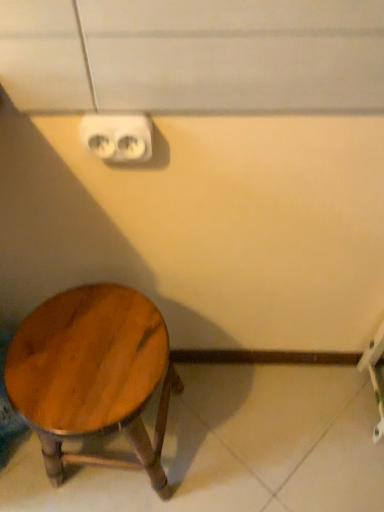
Where is `vacant point above shiny brown wood stool at lower left (from a real-world perspective)`? vacant point above shiny brown wood stool at lower left (from a real-world perspective) is located at coordinates (79, 358).